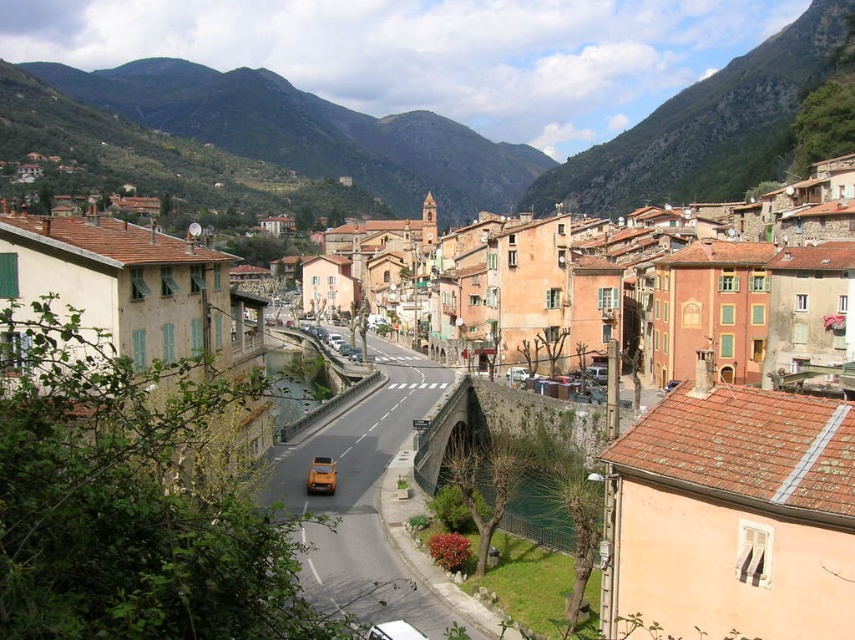
Which is more to the left, green leafy hillside at upper center or green stone hillside at upper center?

green leafy hillside at upper center

Who is more distant from viewer, (174, 128) or (715, 163)?

The point (174, 128) is more distant.

I want to click on green leafy hillside at upper center, so click(x=308, y=132).

Which is more to the right, green leafy hillside at upper center or metallic gold car at center?

metallic gold car at center is more to the right.

Looking at this image, does green leafy hillside at upper center have a larger size compared to metallic gold car at center?

Yes, green leafy hillside at upper center is bigger than metallic gold car at center.

Is point (260, 68) positioned in front of point (328, 486)?

No, (260, 68) is behind (328, 486).

Find the location of `green leafy hillside at upper center`. green leafy hillside at upper center is located at coordinates (308, 132).

Does green stone hillside at upper center appear under metallic gold car at center?

Incorrect, green stone hillside at upper center is not positioned below metallic gold car at center.

Is green stone hillside at upper center shorter than metallic gold car at center?

Incorrect, green stone hillside at upper center's height does not fall short of metallic gold car at center's.

Where is `green stone hillside at upper center`? green stone hillside at upper center is located at coordinates (705, 128).